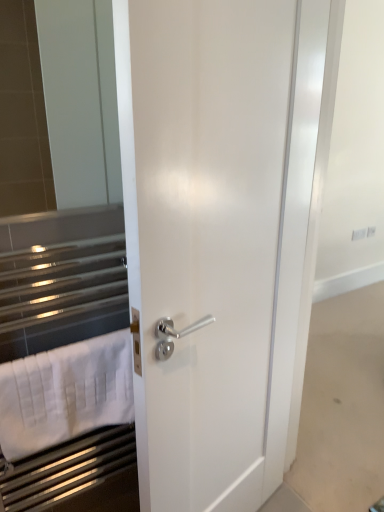
Question: Does white cotton bath towel at left lie behind white glossy door at center?

Choices:
 (A) yes
 (B) no

Answer: (A)

Question: Can you confirm if white cotton bath towel at left is smaller than white glossy door at center?

Choices:
 (A) yes
 (B) no

Answer: (A)

Question: Is white cotton bath towel at left wider than white glossy door at center?

Choices:
 (A) yes
 (B) no

Answer: (B)

Question: From a real-world perspective, is white cotton bath towel at left physically below white glossy door at center?

Choices:
 (A) no
 (B) yes

Answer: (B)

Question: Can you confirm if white cotton bath towel at left is thinner than white glossy door at center?

Choices:
 (A) no
 (B) yes

Answer: (B)

Question: Would you say white cotton bath towel at left is outside white glossy door at center?

Choices:
 (A) yes
 (B) no

Answer: (A)

Question: Is there a large distance between white glossy door at center and white cotton bath towel at left?

Choices:
 (A) no
 (B) yes

Answer: (A)

Question: Is white glossy door at center next to white cotton bath towel at left?

Choices:
 (A) yes
 (B) no

Answer: (B)

Question: Is white glossy door at center to the left of white cotton bath towel at left from the viewer's perspective?

Choices:
 (A) no
 (B) yes

Answer: (A)

Question: Does white glossy door at center appear on the right side of white cotton bath towel at left?

Choices:
 (A) no
 (B) yes

Answer: (B)

Question: Is white glossy door at center further to the viewer compared to white cotton bath towel at left?

Choices:
 (A) no
 (B) yes

Answer: (A)

Question: Can you confirm if white glossy door at center is thinner than white cotton bath towel at left?

Choices:
 (A) yes
 (B) no

Answer: (B)

Question: From a real-world perspective, is white cotton bath towel at left physically located above or below white glossy door at center?

Choices:
 (A) above
 (B) below

Answer: (B)